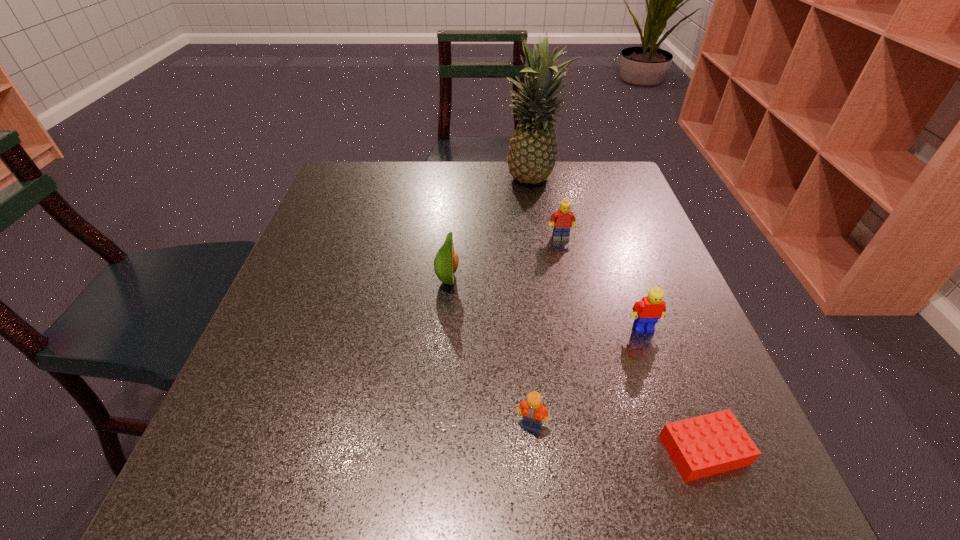
Locate an element on the screen. the farthest object is located at coordinates (533, 151).

Find the location of a particular element. The height and width of the screenshot is (540, 960). the tallest object is located at coordinates (533, 151).

Locate an element on the screen. The height and width of the screenshot is (540, 960). avocado is located at coordinates (446, 261).

At what (x,y) coordinates should I click in order to perform the action: click on the fourth nearest object. Please return your answer as a coordinate pair (x, y). The width and height of the screenshot is (960, 540). Looking at the image, I should click on (446, 261).

This screenshot has width=960, height=540. I want to click on the fifth nearest object, so click(x=561, y=221).

Where is `the farthest Lego`? The height and width of the screenshot is (540, 960). the farthest Lego is located at coordinates (561, 221).

This screenshot has width=960, height=540. Find the location of `the third nearest object`. the third nearest object is located at coordinates (647, 311).

The height and width of the screenshot is (540, 960). Find the location of `the second shortest Lego`. the second shortest Lego is located at coordinates (532, 410).

Where is `the second shortest object`? the second shortest object is located at coordinates (532, 410).

What are the coordinates of `the shortest object` in the screenshot? It's located at (714, 443).